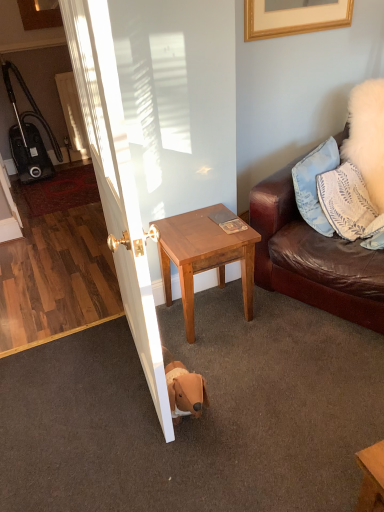
Question: From their relative heights in the image, would you say black plastic vacuum cleaner at left is taller or shorter than blue fabric pillow at upper right, positioned as the first pillow in bottom-to-top order?

Choices:
 (A) tall
 (B) short

Answer: (A)

Question: Relative to blue fabric pillow at upper right, placed as the second pillow when sorted from top to bottom, is black plastic vacuum cleaner at left in front or behind?

Choices:
 (A) front
 (B) behind

Answer: (B)

Question: Estimate the real-world distances between objects in this image. Which object is closer to the light brown wood side table at center?

Choices:
 (A) blue fabric pillow at upper right, positioned as the first pillow in bottom-to-top order
 (B) white fluffy pillow at upper right, which is the 2th pillow from bottom to top
 (C) white glossy door at center
 (D) black plastic vacuum cleaner at left

Answer: (C)

Question: Based on their relative distances, which object is nearer to the light brown wood side table at center?

Choices:
 (A) white glossy door at center
 (B) black plastic vacuum cleaner at left
 (C) blue fabric pillow at upper right, positioned as the first pillow in bottom-to-top order
 (D) white fluffy pillow at upper right, which is the 2th pillow from bottom to top

Answer: (A)